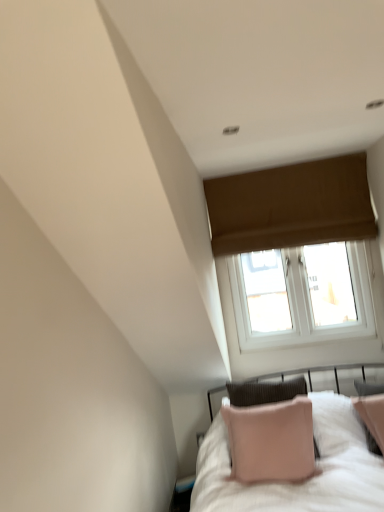
Question: Considering the positions of brown fabric window at upper center and pink fabric pillow at lower right in the image, is brown fabric window at upper center taller or shorter than pink fabric pillow at lower right?

Choices:
 (A) tall
 (B) short

Answer: (A)

Question: Is brown fabric window at upper center inside the boundaries of pink fabric pillow at lower right, or outside?

Choices:
 (A) inside
 (B) outside

Answer: (B)

Question: From a real-world perspective, is brown fabric window at upper center above or below pink fabric pillow at lower right?

Choices:
 (A) above
 (B) below

Answer: (A)

Question: Relative to brown fabric window at upper center, is pink fabric pillow at lower right in front or behind?

Choices:
 (A) behind
 (B) front

Answer: (B)

Question: Is pink fabric pillow at lower right taller or shorter than brown fabric window at upper center?

Choices:
 (A) short
 (B) tall

Answer: (A)

Question: Considering the positions of point (200, 502) and point (344, 230), is point (200, 502) closer or farther from the camera than point (344, 230)?

Choices:
 (A) farther
 (B) closer

Answer: (B)

Question: Would you say pink fabric pillow at lower right is to the left or to the right of brown fabric window at upper center in the picture?

Choices:
 (A) left
 (B) right

Answer: (A)